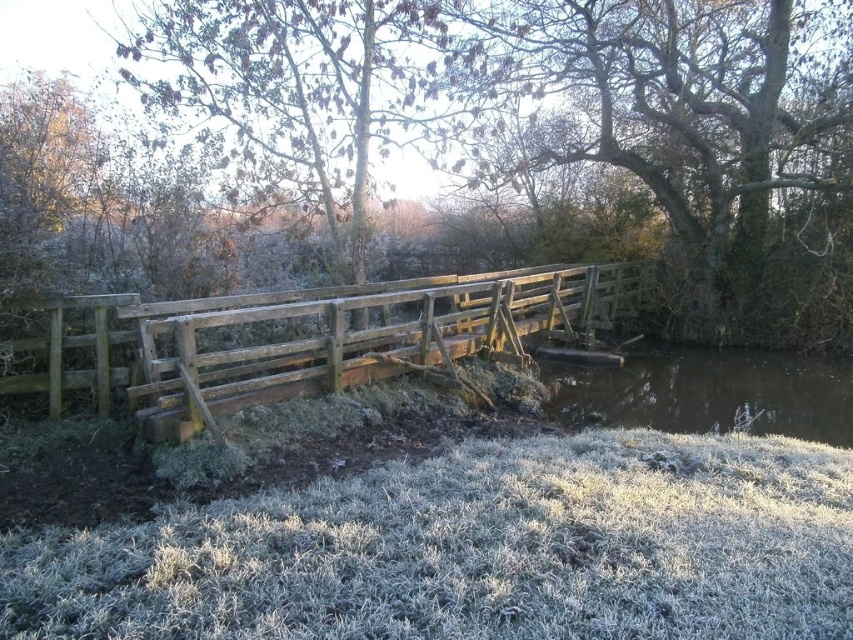
You are standing at the center of the rustic wooden bridge and see two points marked in the scene. One is at point (440,545) and the other at point (755,314). Which point is closer to you?

Point (440,545) is in front of point (755,314), so the point at (440,545) is closer to you.